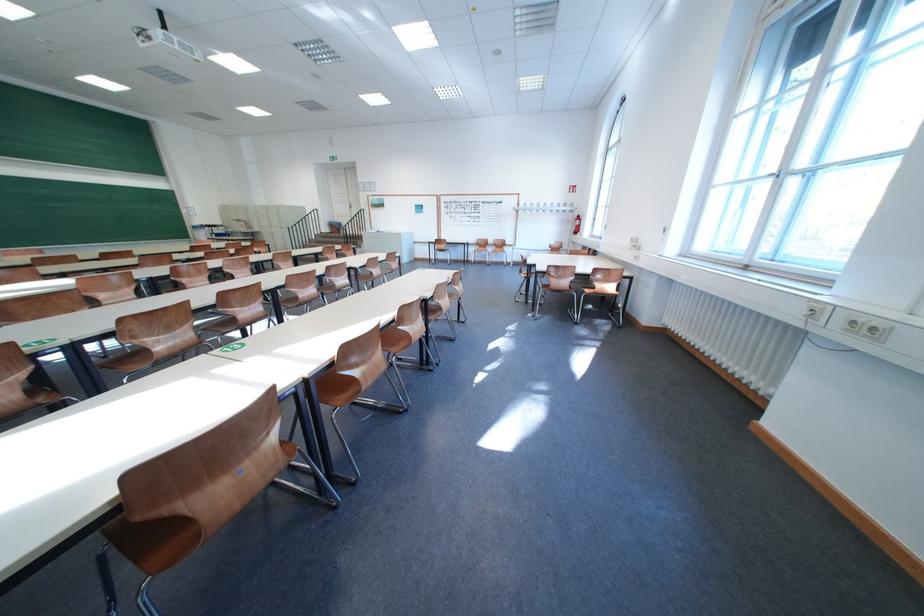
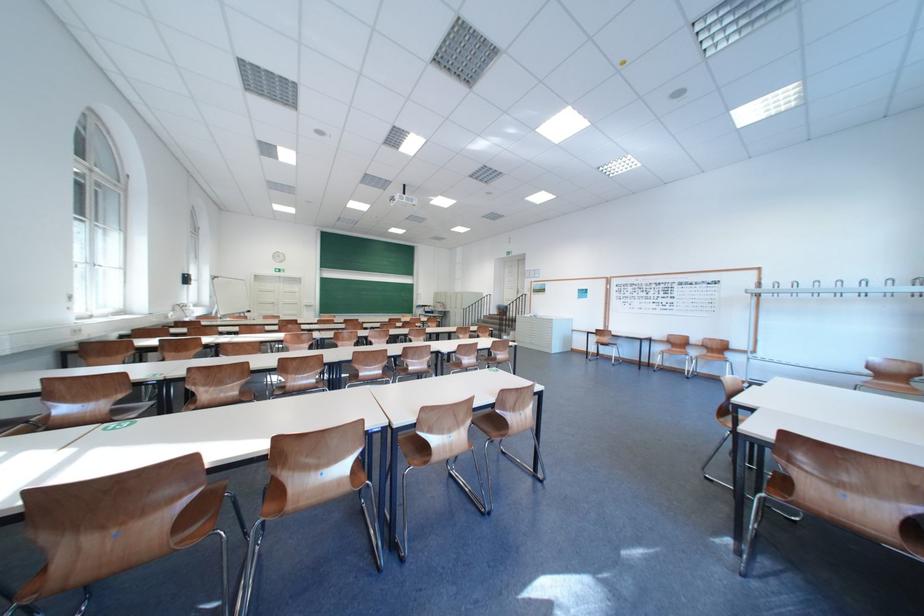
Where in the second image is the point corresponding to the point at 314,299 from the first image?

(375, 376)